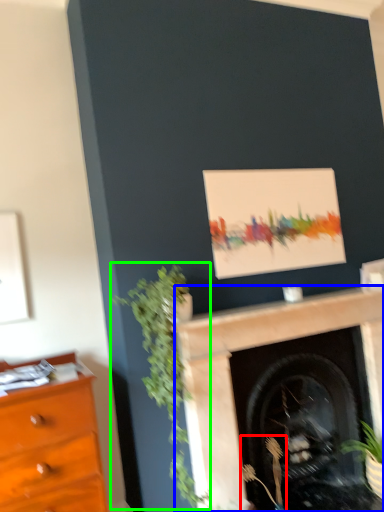
Question: Which object is the closest to the plant (highlighted by a red box)? Choose among these: fireplace (highlighted by a blue box) or plant (highlighted by a green box).

Choices:
 (A) fireplace
 (B) plant

Answer: (A)